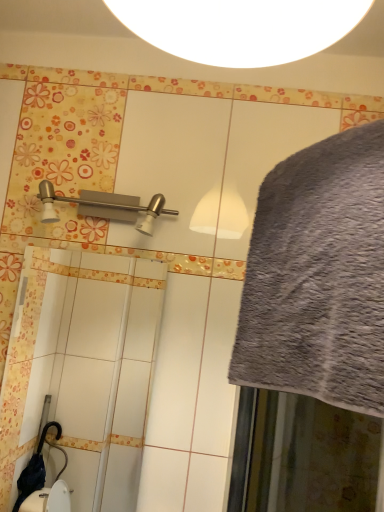
Question: Is gray fluffy bath towel at right located within satin nickel shower at upper left?

Choices:
 (A) no
 (B) yes

Answer: (A)

Question: Is satin nickel shower at upper left not close to gray fluffy bath towel at right?

Choices:
 (A) no
 (B) yes

Answer: (A)

Question: Could you tell me if satin nickel shower at upper left is turned towards gray fluffy bath towel at right?

Choices:
 (A) yes
 (B) no

Answer: (B)

Question: Can you confirm if satin nickel shower at upper left is positioned to the left of gray fluffy bath towel at right?

Choices:
 (A) no
 (B) yes

Answer: (B)

Question: From the image's perspective, is satin nickel shower at upper left beneath gray fluffy bath towel at right?

Choices:
 (A) yes
 (B) no

Answer: (B)

Question: Can you confirm if satin nickel shower at upper left is positioned to the right of gray fluffy bath towel at right?

Choices:
 (A) yes
 (B) no

Answer: (B)

Question: From a real-world perspective, is gray fluffy bath towel at right positioned under satin nickel shower at upper left based on gravity?

Choices:
 (A) yes
 (B) no

Answer: (A)

Question: Can you confirm if gray fluffy bath towel at right is wider than satin nickel shower at upper left?

Choices:
 (A) yes
 (B) no

Answer: (A)

Question: Considering the relative sizes of gray fluffy bath towel at right and satin nickel shower at upper left in the image provided, is gray fluffy bath towel at right bigger than satin nickel shower at upper left?

Choices:
 (A) no
 (B) yes

Answer: (B)

Question: Is gray fluffy bath towel at right to the left of satin nickel shower at upper left from the viewer's perspective?

Choices:
 (A) yes
 (B) no

Answer: (B)

Question: Considering the relative positions of gray fluffy bath towel at right and satin nickel shower at upper left in the image provided, is gray fluffy bath towel at right behind satin nickel shower at upper left?

Choices:
 (A) yes
 (B) no

Answer: (B)

Question: Is satin nickel shower at upper left at the back of gray fluffy bath towel at right?

Choices:
 (A) yes
 (B) no

Answer: (B)

Question: Is satin nickel shower at upper left inside or outside of gray fluffy bath towel at right?

Choices:
 (A) outside
 (B) inside

Answer: (A)